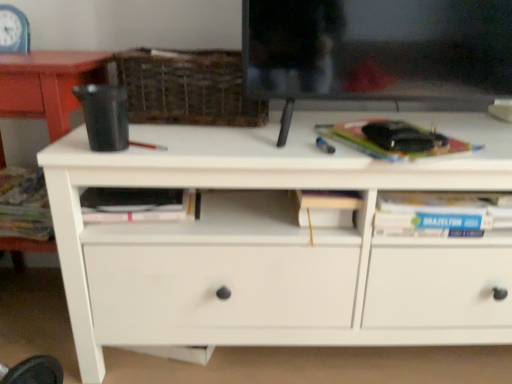
Question: From the image's perspective, is woven brown basket at upper center positioned above or below white matte chest of drawers at center?

Choices:
 (A) below
 (B) above

Answer: (B)

Question: Considering the positions of woven brown basket at upper center and white matte chest of drawers at center in the image, is woven brown basket at upper center wider or thinner than white matte chest of drawers at center?

Choices:
 (A) thin
 (B) wide

Answer: (A)

Question: Which of these objects is positioned closest to the hardcover book at right, which is counted as the 1th paperback book, starting from the right?

Choices:
 (A) hardcover book at left
 (B) pink matte paperback book at center, arranged as the first paperback book when viewed from the left
 (C) white matte chest of drawers at center
 (D) woven brown basket at upper center
 (E) blue plastic clock at upper left

Answer: (C)

Question: Considering the real-world distances, which object is farthest from the woven brown basket at upper center?

Choices:
 (A) pink matte paperback book at center, the 1th paperback book positioned from the bottom
 (B) hardcover book at left
 (C) white matte chest of drawers at center
 (D) hardcover book at right, the first paperback book in the top-to-bottom sequence
 (E) blue plastic clock at upper left

Answer: (E)